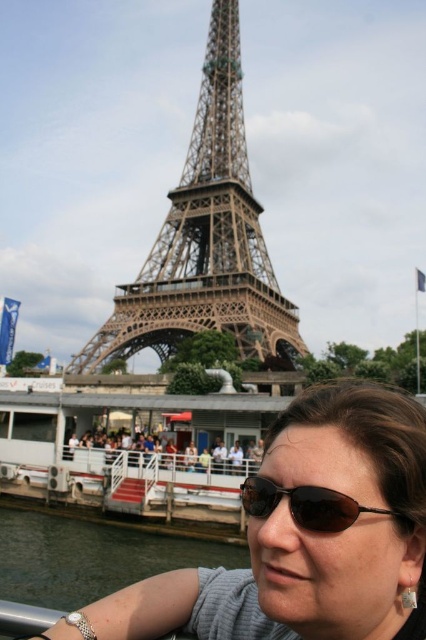
Question: Can you confirm if matte gray sunglasses at center is positioned above black plastic sunglasses at lower center?

Choices:
 (A) yes
 (B) no

Answer: (B)

Question: Can you confirm if matte gray sunglasses at center is positioned below green patina metal eiffel tower at center?

Choices:
 (A) no
 (B) yes

Answer: (B)

Question: Is green patina metal eiffel tower at center smaller than black plastic sunglasses at lower center?

Choices:
 (A) no
 (B) yes

Answer: (A)

Question: Among these objects, which one is nearest to the camera?

Choices:
 (A) matte gray sunglasses at center
 (B) green patina metal eiffel tower at center

Answer: (A)

Question: Among these points, which one is nearest to the camera?

Choices:
 (A) (209, 134)
 (B) (249, 582)
 (C) (310, 509)

Answer: (C)

Question: Which point is farther from the camera taking this photo?

Choices:
 (A) (411, 570)
 (B) (313, 518)
 (C) (233, 243)

Answer: (C)